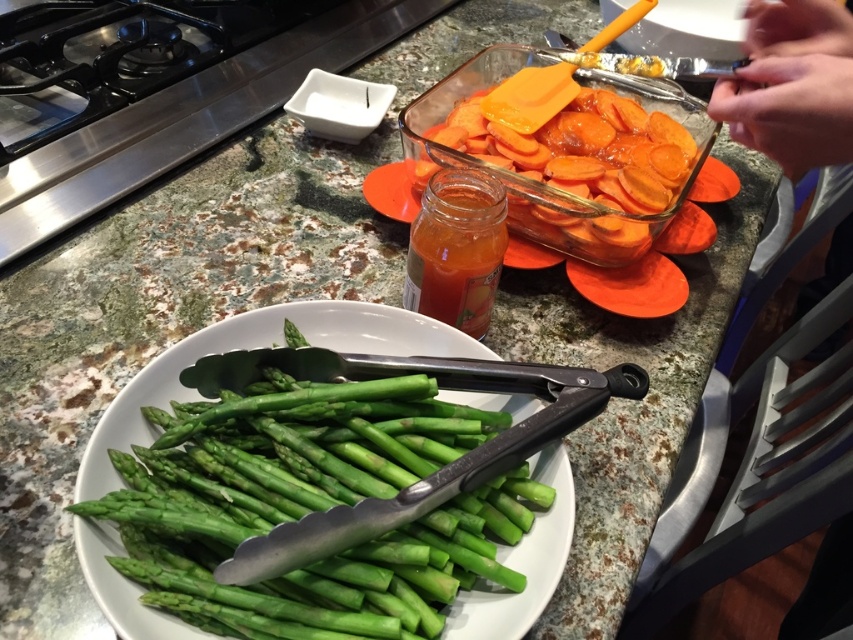
What is located at the point with coordinates (x=258, y=348) on the kitchen countertop?

The point with coordinates (x=258, y=348) marks the location of the green matte asparagus at center.

You are a chef preparing a meal and need to place a garnish on the plate. The garnish must be placed exactly at point [258,348]. What object is located at that point?

The point [258,348] is where the green matte asparagus at center is located.